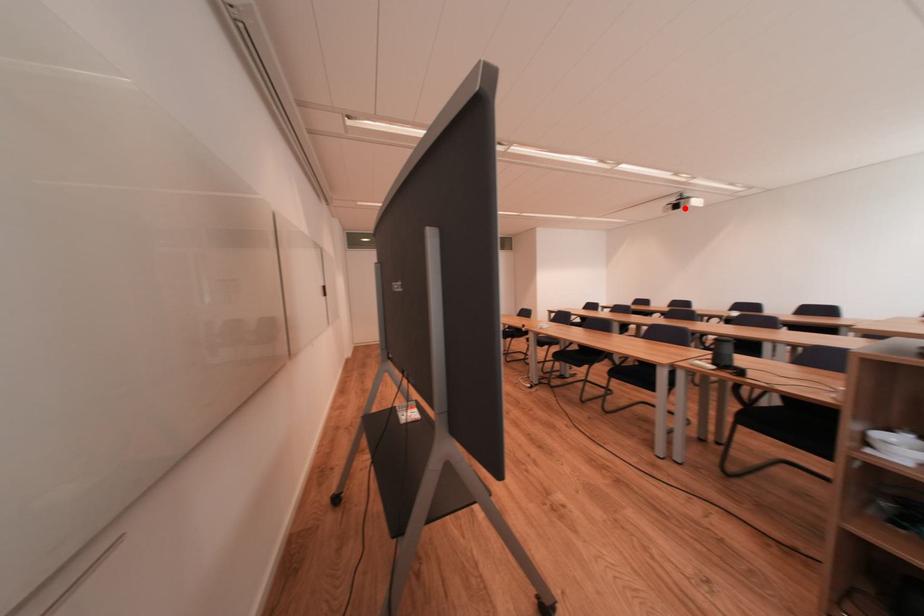
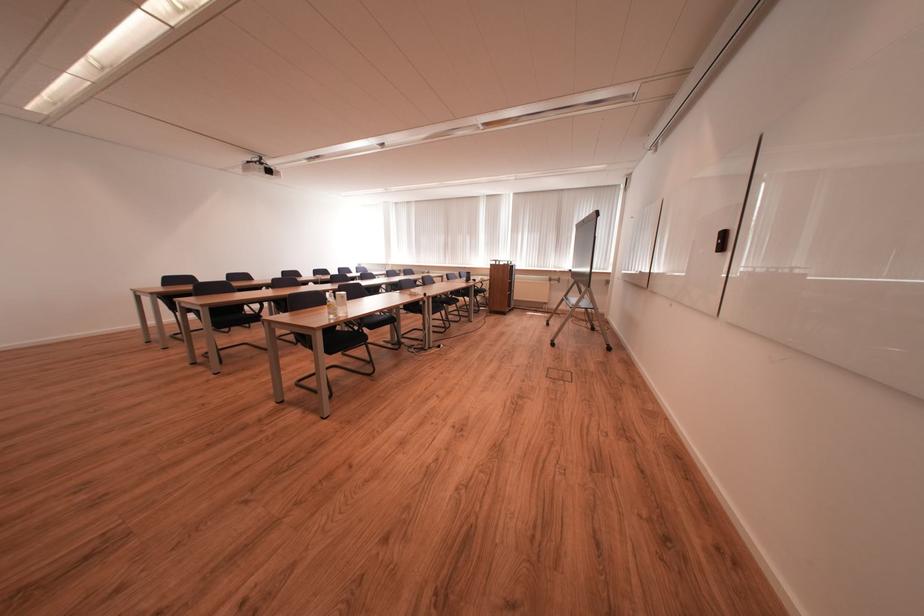
Question: I am providing you with two images of the same scene from different viewpoints. A red point is marked on the first image. Is the red point's position out of view in image 2?

Choices:
 (A) Yes
 (B) No

Answer: (B)